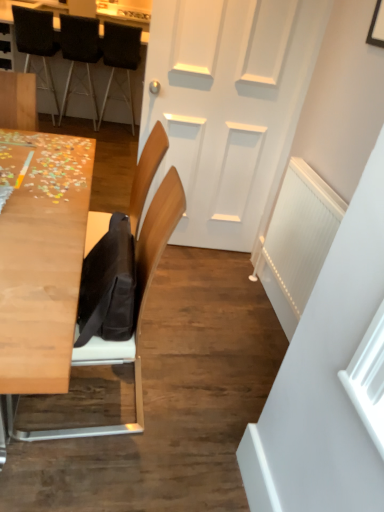
This screenshot has height=512, width=384. In order to click on free spot in front of white plastic radiator at right in this screenshot , I will do `click(249, 351)`.